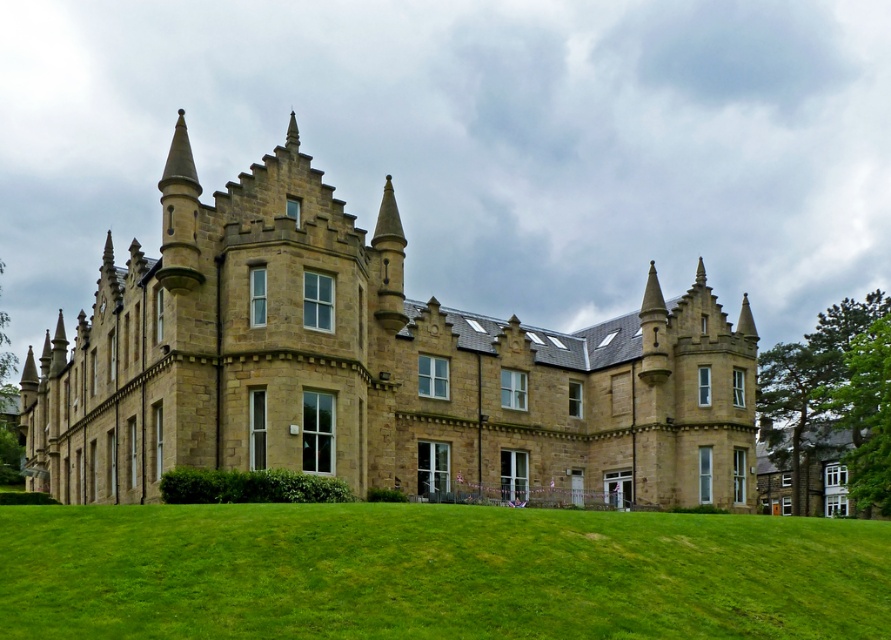
Question: Which point appears closest to the camera in this image?

Choices:
 (A) (366, 614)
 (B) (97, 298)

Answer: (A)

Question: Is brown stone castle at center below green grassy field at lower center?

Choices:
 (A) yes
 (B) no

Answer: (B)

Question: Where is brown stone castle at center located in relation to green grassy field at lower center in the image?

Choices:
 (A) left
 (B) right

Answer: (A)

Question: Is brown stone castle at center to the left of green grassy field at lower center from the viewer's perspective?

Choices:
 (A) yes
 (B) no

Answer: (A)

Question: Among these objects, which one is nearest to the camera?

Choices:
 (A) green grassy field at lower center
 (B) brown stone castle at center

Answer: (A)

Question: Which point appears farthest from the camera in this image?

Choices:
 (A) click(x=689, y=540)
 (B) click(x=136, y=465)

Answer: (B)